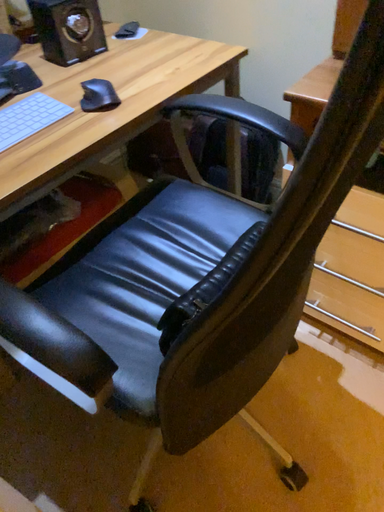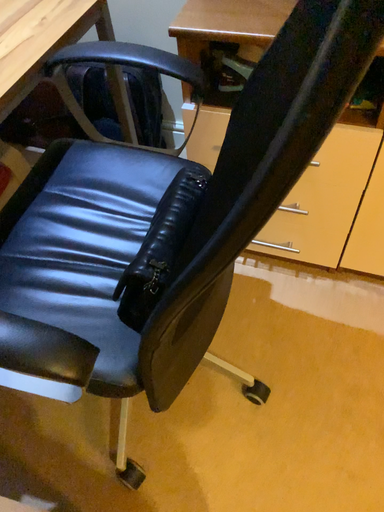
Question: How did the camera likely rotate when shooting the video?

Choices:
 (A) rotated right
 (B) rotated left

Answer: (A)